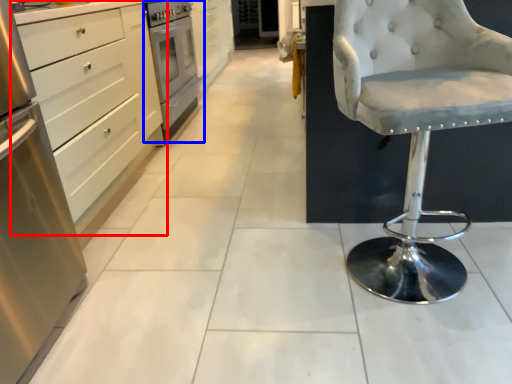
Question: Among these objects, which one is nearest to the camera, cabinetry (highlighted by a red box) or home appliance (highlighted by a blue box)?

Choices:
 (A) cabinetry
 (B) home appliance

Answer: (A)